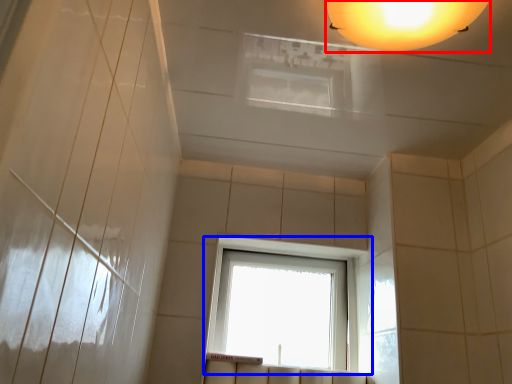
Question: Which of the following is the farthest to the observer, lamp (highlighted by a red box) or window (highlighted by a blue box)?

Choices:
 (A) lamp
 (B) window

Answer: (B)